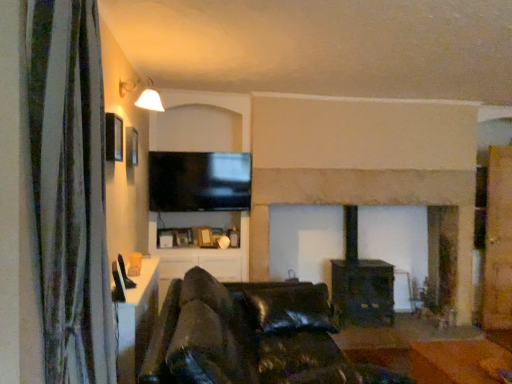
Question: Is green fabric curtain at left bigger or smaller than black glossy tv at upper center?

Choices:
 (A) small
 (B) big

Answer: (B)

Question: In terms of height, does green fabric curtain at left look taller or shorter compared to black glossy tv at upper center?

Choices:
 (A) tall
 (B) short

Answer: (A)

Question: Which is nearer to the black glossy tv at upper center?

Choices:
 (A) stone fireplace at center
 (B) green fabric curtain at left
 (C) orange leather couch at lower center
 (D) black leather couch at center
 (E) matte white lampshade at upper left

Answer: (A)

Question: Which object is positioned closest to the orange leather couch at lower center?

Choices:
 (A) matte white lampshade at upper left
 (B) stone fireplace at center
 (C) green fabric curtain at left
 (D) black leather couch at center
 (E) black glossy tv at upper center

Answer: (D)